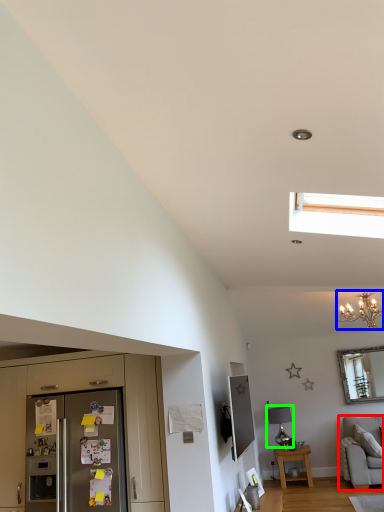
Question: Estimate the real-world distances between objects in this image. Which object is closer to studio couch (highlighted by a red box), light fixture (highlighted by a blue box) or lamp (highlighted by a green box)?

Choices:
 (A) light fixture
 (B) lamp

Answer: (B)